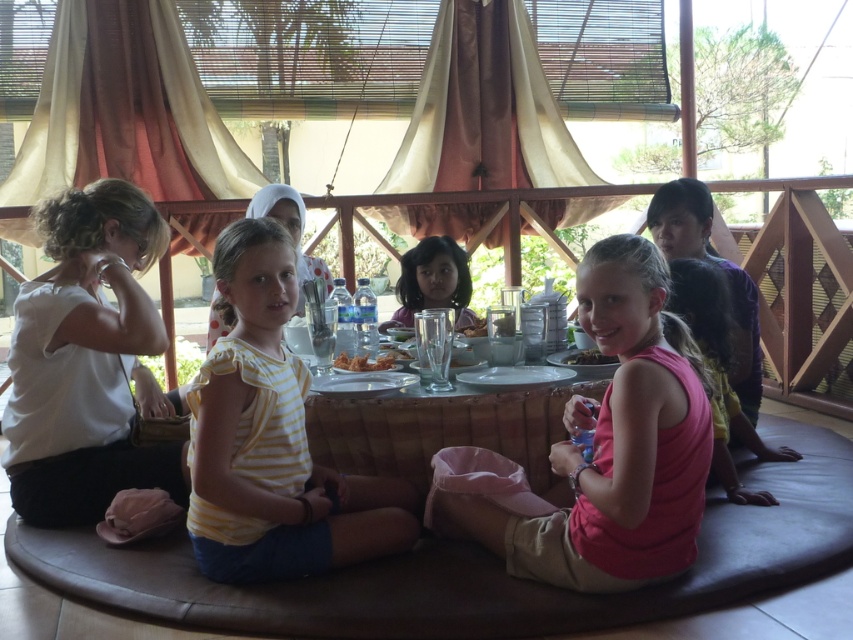
Which of these two, white matte shirt at left or smooth brown hair at center, stands shorter?

With less height is smooth brown hair at center.

Does white matte shirt at left lie behind smooth brown hair at center?

No, it is in front of smooth brown hair at center.

Between point (96, 225) and point (451, 252), which one is positioned in front?

Point (96, 225) is in front.

At what (x,y) coordinates should I click in order to perform the action: click on white matte shirt at left. Please return your answer as a coordinate pair (x, y). Looking at the image, I should click on (86, 360).

Measure the distance from pink fabric dress at center to golden crispy fried chicken at center.

pink fabric dress at center and golden crispy fried chicken at center are 4.22 feet apart.

This screenshot has width=853, height=640. I want to click on pink fabric dress at center, so click(x=718, y=371).

This screenshot has height=640, width=853. Identify the location of pink fabric dress at center. (718, 371).

Between yellow striped shirt at center and dark brown glossy plate at center, which one appears on the right side from the viewer's perspective?

dark brown glossy plate at center is more to the right.

Is yellow striped shirt at center shorter than dark brown glossy plate at center?

No, yellow striped shirt at center is not shorter than dark brown glossy plate at center.

What do you see at coordinates (271, 440) in the screenshot? I see `yellow striped shirt at center` at bounding box center [271, 440].

Find the location of a particular element. This screenshot has width=853, height=640. yellow striped shirt at center is located at coordinates (271, 440).